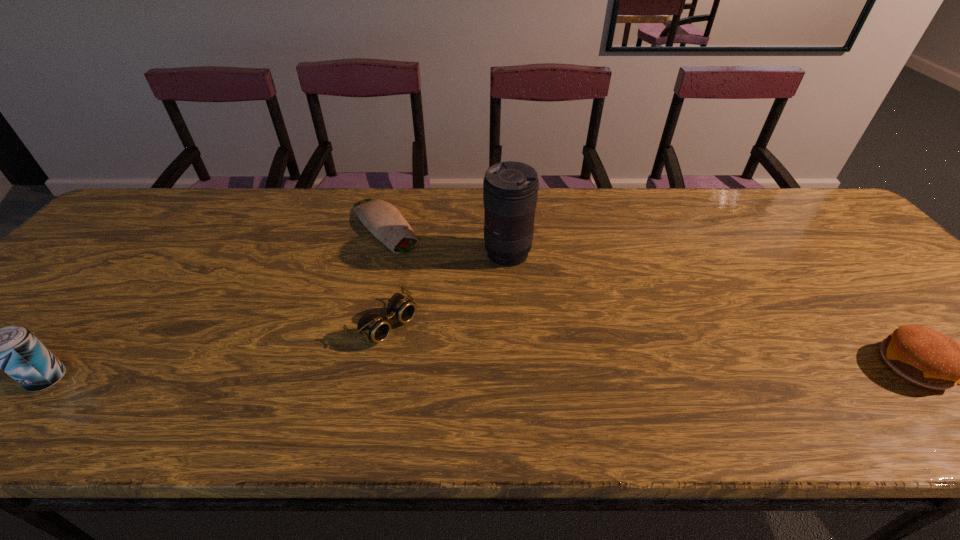
You are a GUI agent. You are given a task and a screenshot of the screen. Output one action in this format:
    pyautogui.click(x=<x>, y=<y>)
    Task: Click on the free space on the desktop that is between the leftmost object and the rightmost object and is positioned on the side of the second object from right to left where the control switches are located
    The height and width of the screenshot is (540, 960).
    Given the screenshot: What is the action you would take?
    pyautogui.click(x=373, y=374)

Identify the location of vacant space on the desktop that is between the fourth shortest object and the hamburger and is positioned at the bitten end of the shortest object. The image size is (960, 540). (523, 372).

The image size is (960, 540). Identify the location of free space on the desktop that is between the leftmost object and the hamburger and is positioned through the lenses of the goggles. (449, 373).